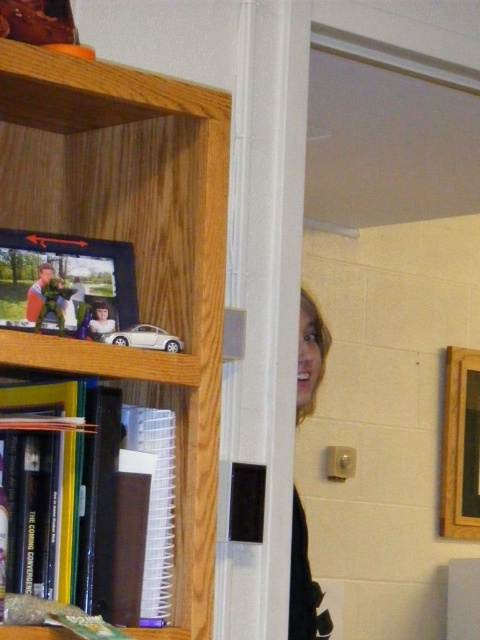
You are trying to hang a new painting on the wall next to the wooden bookshelf at upper left and the matte plastic picture frame at left. Which object should you avoid placing the painting too close to because it is taller?

You should avoid placing the painting too close to the wooden bookshelf at upper left because it has a greater height compared to the matte plastic picture frame at left.

You are standing in the room and want to locate the point at coordinates (133,248). Based on the scene description, where exactly is this point located?

The point at coordinates (133,248) is on the wooden bookshelf at upper left.

You are organizing a small space and need to know which object takes up more room. Which is bigger between the wooden bookshelf at upper left and the wooden picture frame at upper right?

The wooden bookshelf at upper left is larger in size than the wooden picture frame at upper right, so it takes up more space.